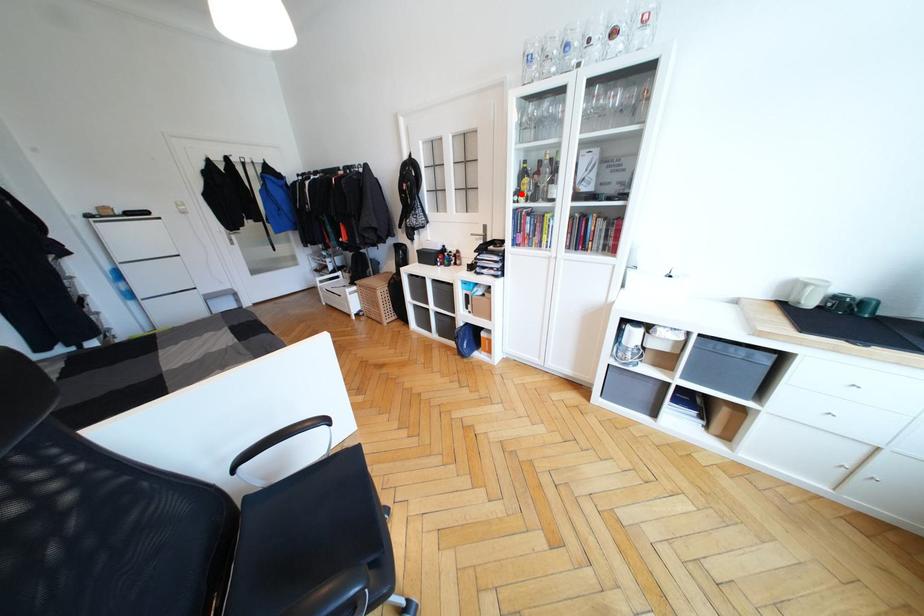
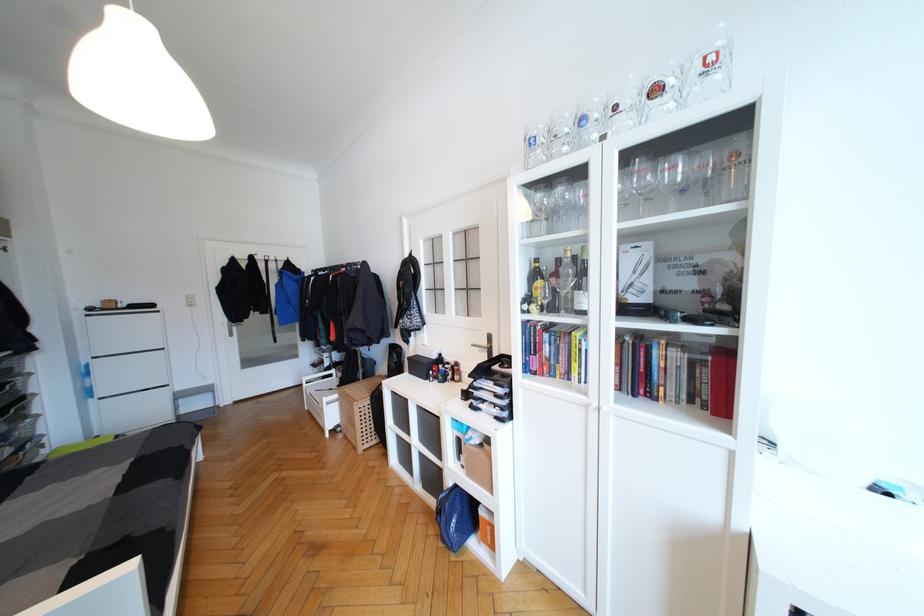
Question: I am providing you with two images of the same scene from different viewpoints. Image1 has a red point marked. In image2, the corresponding 3D location appears at what relative position? Reply with the corresponding letter.

Choices:
 (A) Closer
 (B) Farther

Answer: (B)